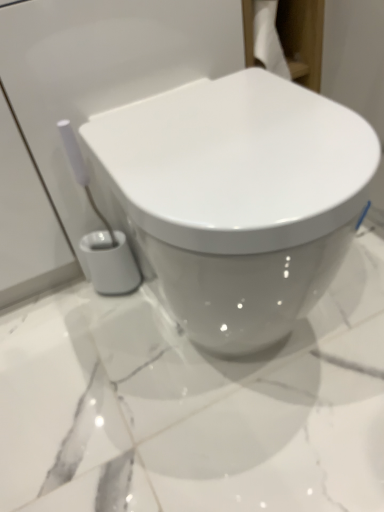
This screenshot has width=384, height=512. I want to click on white glossy toilet at center, so click(x=239, y=198).

In order to face white glossy toilet at center, should I rotate leftwards or rightwards?

To face it directly, rotate right by 4.933 degrees.

What do you see at coordinates (239, 198) in the screenshot? The width and height of the screenshot is (384, 512). I see `white glossy toilet at center` at bounding box center [239, 198].

Image resolution: width=384 pixels, height=512 pixels. What are the coordinates of `white glossy toilet at center` in the screenshot? It's located at (239, 198).